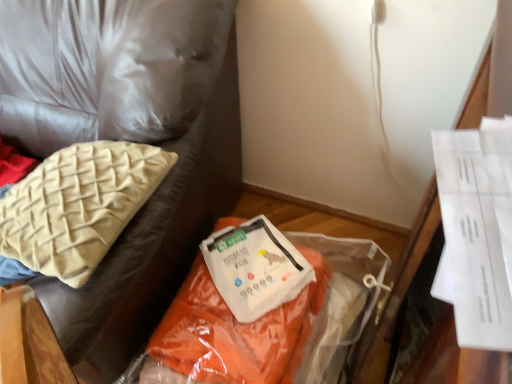
Question: From the image's perspective, is beige woven cushion at upper left on orange fabric at center?

Choices:
 (A) no
 (B) yes

Answer: (B)

Question: From the image's perspective, is beige woven cushion at upper left located beneath orange fabric at center?

Choices:
 (A) no
 (B) yes

Answer: (A)

Question: Is beige woven cushion at upper left to the right of orange fabric at center from the viewer's perspective?

Choices:
 (A) no
 (B) yes

Answer: (A)

Question: From a real-world perspective, is beige woven cushion at upper left over orange fabric at center?

Choices:
 (A) no
 (B) yes

Answer: (B)

Question: Does beige woven cushion at upper left have a greater height compared to orange fabric at center?

Choices:
 (A) yes
 (B) no

Answer: (B)

Question: Relative to orange fabric bag at lower right, is orange fabric at center in front or behind?

Choices:
 (A) behind
 (B) front

Answer: (A)

Question: Considering the positions of point (243, 350) and point (231, 52), is point (243, 350) closer or farther from the camera than point (231, 52)?

Choices:
 (A) closer
 (B) farther

Answer: (A)

Question: From the image's perspective, is orange fabric at center positioned above or below orange fabric bag at lower right?

Choices:
 (A) below
 (B) above

Answer: (A)

Question: From a real-world perspective, is orange fabric at center above or below orange fabric bag at lower right?

Choices:
 (A) above
 (B) below

Answer: (B)

Question: In the image, is white paper at center on the left side or the right side of beige woven cushion at upper left?

Choices:
 (A) left
 (B) right

Answer: (B)

Question: In the image, is white paper at center positioned in front of or behind beige woven cushion at upper left?

Choices:
 (A) behind
 (B) front

Answer: (A)

Question: Do you think white paper at center is within beige woven cushion at upper left, or outside of it?

Choices:
 (A) inside
 (B) outside

Answer: (B)

Question: From a real-world perspective, is white paper at center physically located above or below beige woven cushion at upper left?

Choices:
 (A) below
 (B) above

Answer: (A)

Question: Considering the positions of point (245, 279) and point (287, 263), is point (245, 279) closer or farther from the camera than point (287, 263)?

Choices:
 (A) closer
 (B) farther

Answer: (A)

Question: Looking at the image, does white paper at center seem bigger or smaller compared to orange fabric at center?

Choices:
 (A) small
 (B) big

Answer: (A)